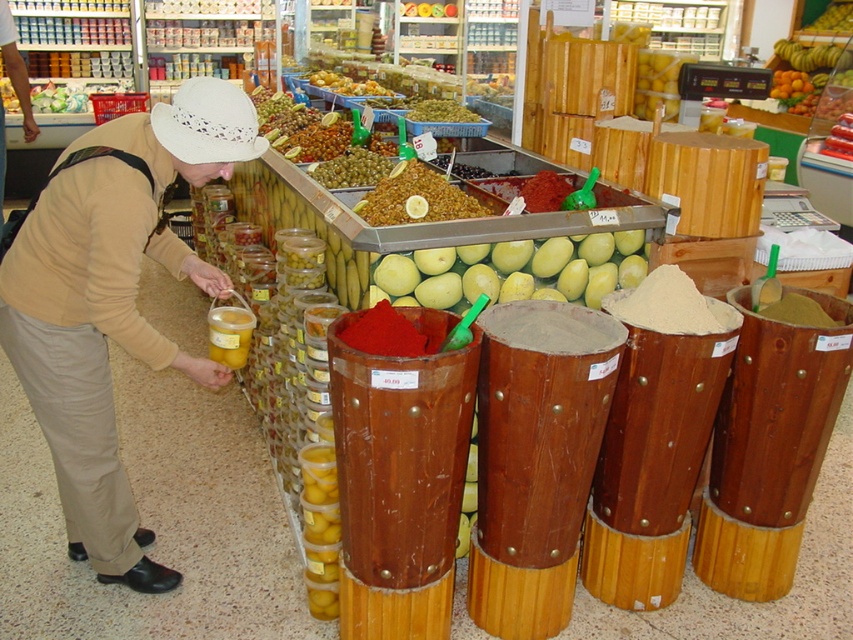
Question: Based on their relative distances, which object is farther from the green matte olives at center?

Choices:
 (A) beige sweater at center
 (B) yellow smooth mango at center

Answer: (A)

Question: Based on their relative distances, which object is farther from the green olive at center?

Choices:
 (A) beige sweater at center
 (B) green matte olives at center

Answer: (A)

Question: Which object is the farthest from the green matte olives at center?

Choices:
 (A) beige sweater at center
 (B) yellow smooth mango at center
 (C) green olive at center

Answer: (C)

Question: Does green matte olives at center have a greater width compared to green olive at center?

Choices:
 (A) yes
 (B) no

Answer: (A)

Question: Is beige sweater at center behind yellow smooth mango at center?

Choices:
 (A) no
 (B) yes

Answer: (A)

Question: Where is yellow smooth mango at center located in relation to green olive at center in the image?

Choices:
 (A) above
 (B) below

Answer: (B)